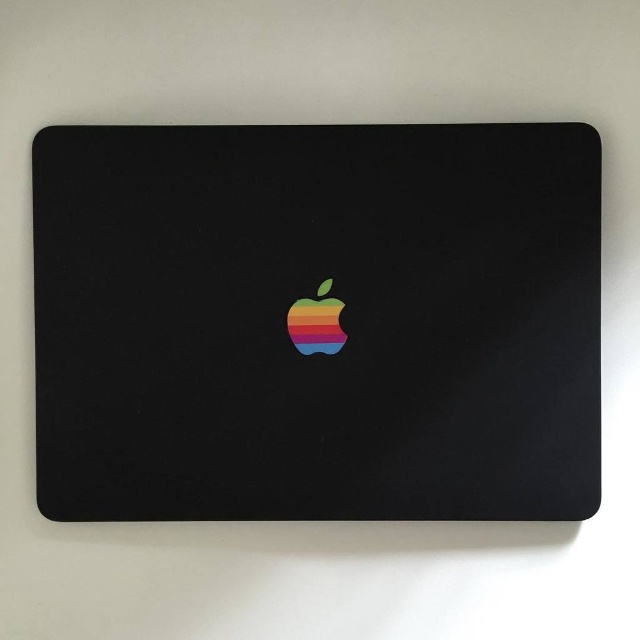
You are holding a ruler and want to measure the distance from your eyes to the matte black laptop at center in the image. If the ruler is 12 inches long, how many rulers do you need to stack end to end to reach the distance?

The distance of matte black laptop at center from viewer is 38.25 inches. Since each ruler is 12 inches long, you would need 38.25 divided by 12, which equals approximately 3.19 rulers. Since you can only use whole rulers, you would need 4 rulers stacked end to end to cover the distance.

You are holding a black laptop lid with two points marked on it. The first point is at coordinates point (209, 298), and the second point is at coordinates point (324, 339). If you look at the laptop from the front, which point appears closer to you?

Point (209, 298) appears closer to you because it is in front of point (324, 339).